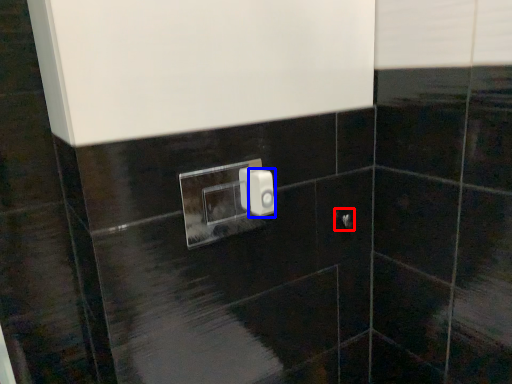
Question: Among these objects, which one is farthest to the camera, door handle (highlighted by a red box) or light switch (highlighted by a blue box)?

Choices:
 (A) door handle
 (B) light switch

Answer: (A)